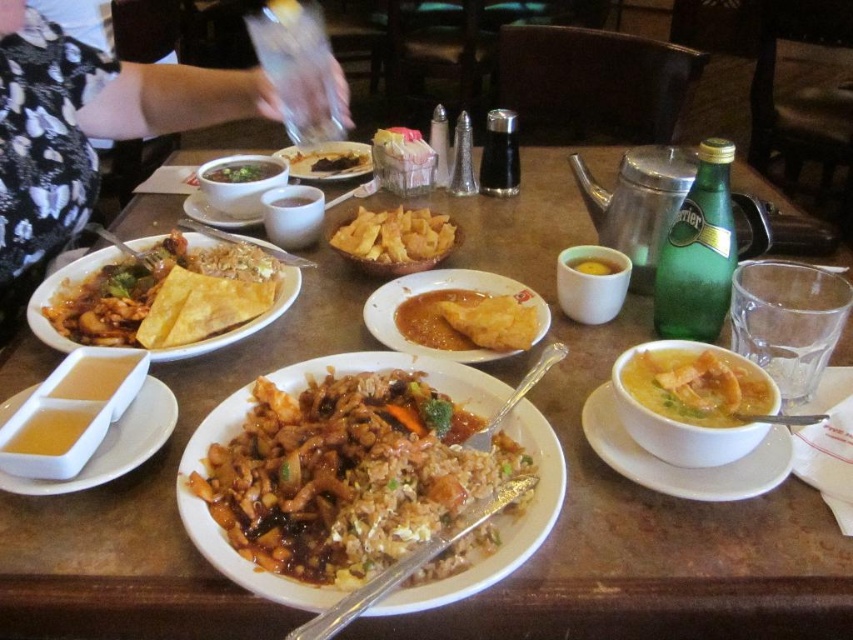
Can you confirm if black lace dress at left is taller than brown matte rice at center?

Indeed, black lace dress at left has a greater height compared to brown matte rice at center.

Does point (61, 236) come farther from viewer compared to point (422, 483)?

That is True.

Who is more forward, (70,193) or (424,506)?

Point (424,506)

This screenshot has width=853, height=640. Identify the location of black lace dress at left. (86, 124).

Which of these two, brown glossy fried rice at center or dark brown crispy fried chicken at center, stands taller?

brown glossy fried rice at center

Does brown glossy fried rice at center appear on the right side of dark brown crispy fried chicken at center?

Correct, you'll find brown glossy fried rice at center to the right of dark brown crispy fried chicken at center.

Is point (428, 400) positioned after point (338, 144)?

No, it is in front of (338, 144).

At what (x,y) coordinates should I click in order to perform the action: click on brown glossy fried rice at center. Please return your answer as a coordinate pair (x, y). Looking at the image, I should click on (346, 474).

Is white matte rectangular dish at lower left smaller than matte white plate at center?

Actually, white matte rectangular dish at lower left might be larger than matte white plate at center.

Between white matte rectangular dish at lower left and matte white plate at center, which one has more height?

white matte rectangular dish at lower left is taller.

This screenshot has height=640, width=853. What are the coordinates of `white matte rectangular dish at lower left` in the screenshot? It's located at (113, 445).